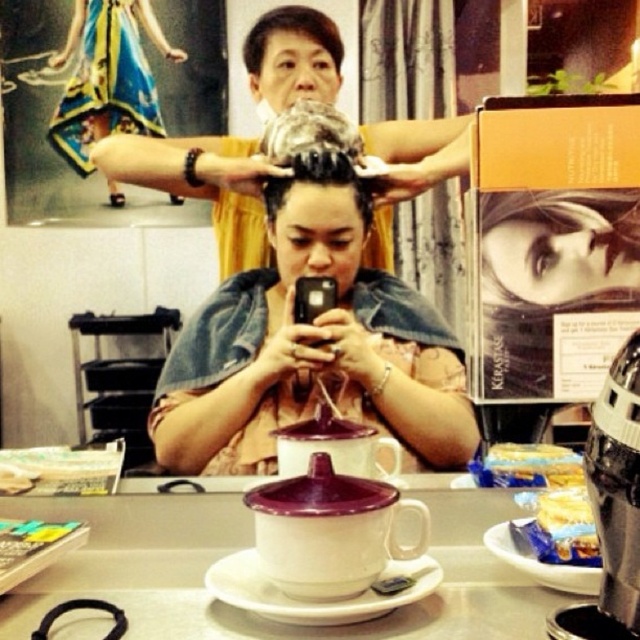
You are a customer in the salon and want to place your handbag on the table. The handbag is 30 cm wide. Is there enough space between the denim jacket at center and the metallic silver coffee machine at lower right to place it?

The denim jacket at center might be wider than metallic silver coffee machine at lower right, so the space between them may not be sufficient to accommodate a 30 cm wide handbag. Check the actual width before placing it.

You are a customer in the salon and want to grab the metallic silver coffee machine at lower right without disturbing the short hair at upper center. Can you reach it easily?

The metallic silver coffee machine at lower right is closer to the viewer than short hair at upper center, so yes, you can reach it easily without disturbing the short hair at upper center.